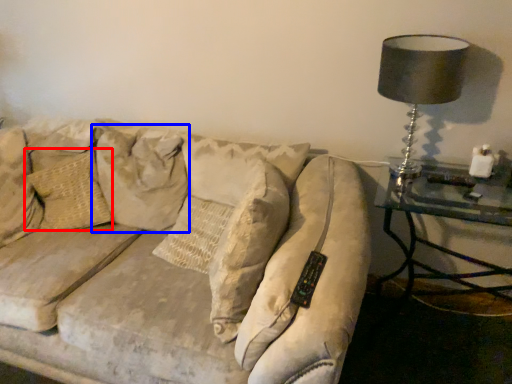
Question: Which object appears farthest to the camera in this image, pillow (highlighted by a red box) or pillow (highlighted by a blue box)?

Choices:
 (A) pillow
 (B) pillow

Answer: (A)